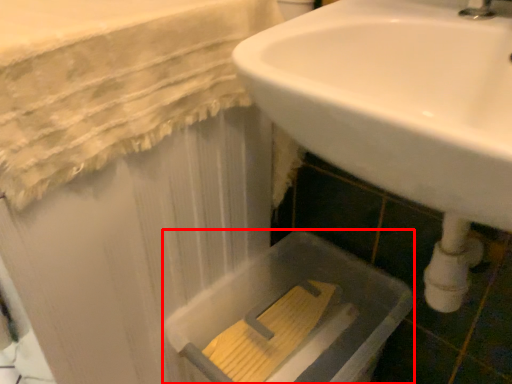
Question: Considering the relative positions of bath (annotated by the red box) and sink in the image provided, where is bath (annotated by the red box) located with respect to the staircase?

Choices:
 (A) right
 (B) left

Answer: (B)